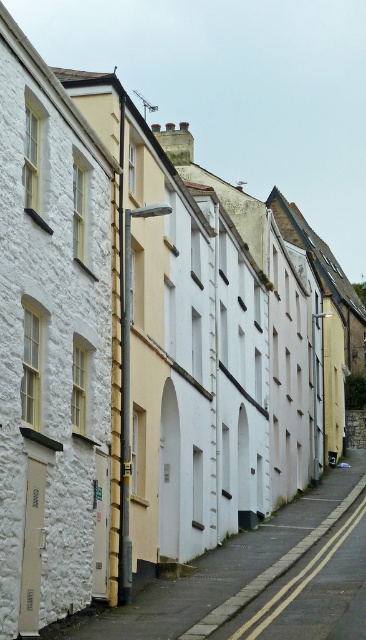
Which is in front, point (58, 385) or point (299, 572)?

Point (58, 385) is more forward.

What do you see at coordinates (50, 342) in the screenshot?
I see `white stone building at center` at bounding box center [50, 342].

Who is more forward, (20, 621) or (363, 506)?

Positioned in front is point (20, 621).

The width and height of the screenshot is (366, 640). I want to click on white stone building at center, so click(x=50, y=342).